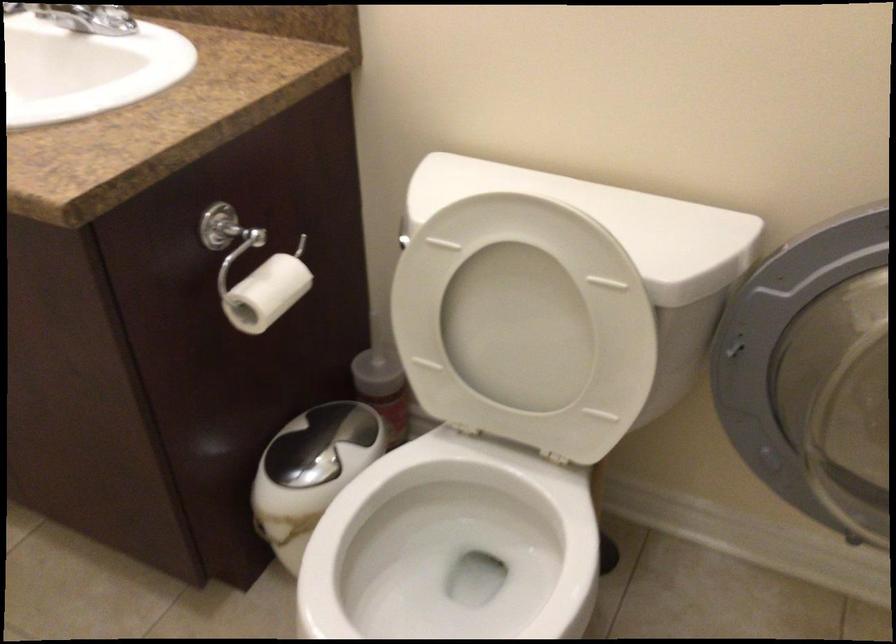
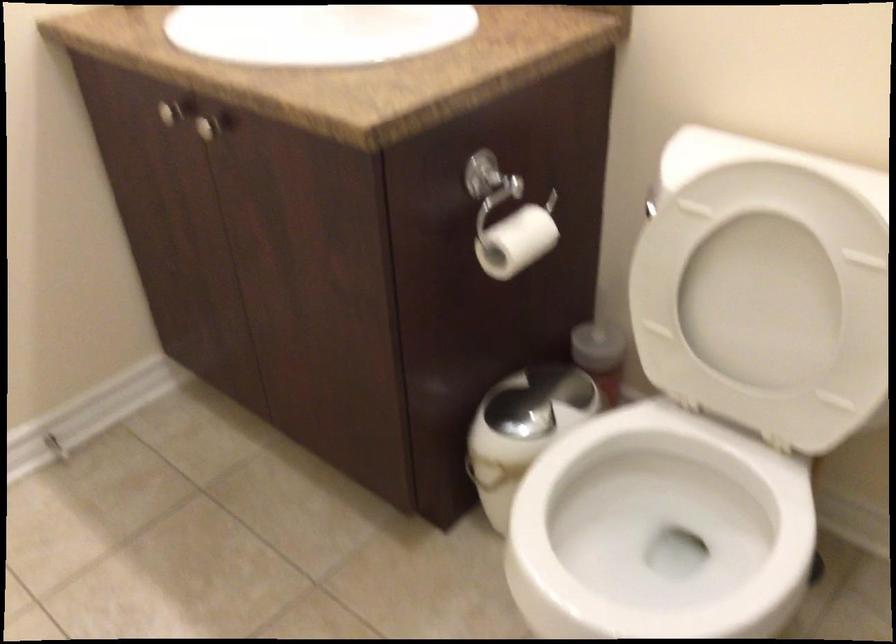
Question: The camera is either moving clockwise (left) or counter-clockwise (right) around the object. The first image is from the beginning of the video and the second image is from the end. Is the camera moving left or right when shooting the video?

Choices:
 (A) Left
 (B) Right

Answer: (B)